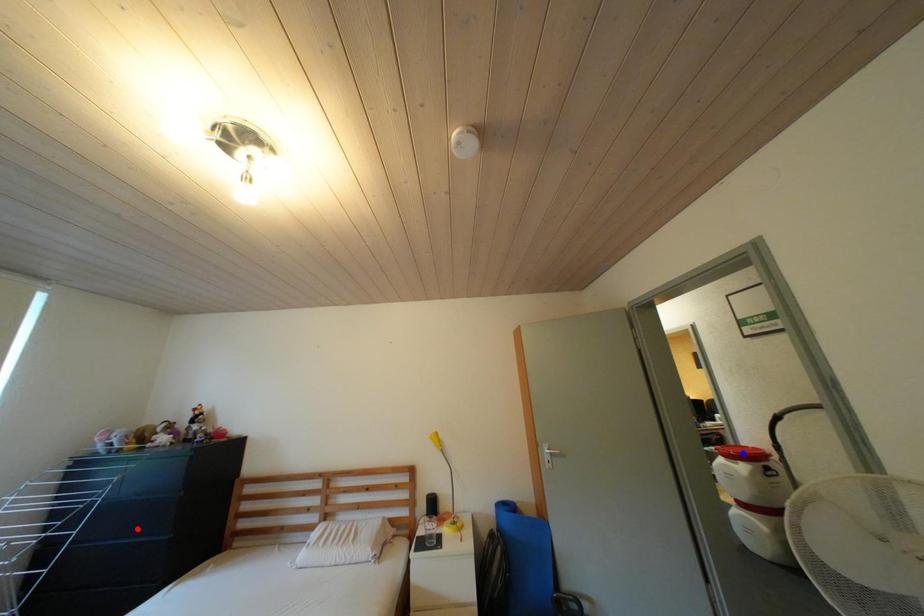
Question: Which of the two points in the image is closer to the camera?

Choices:
 (A) Blue point is closer.
 (B) Red point is closer.

Answer: (B)